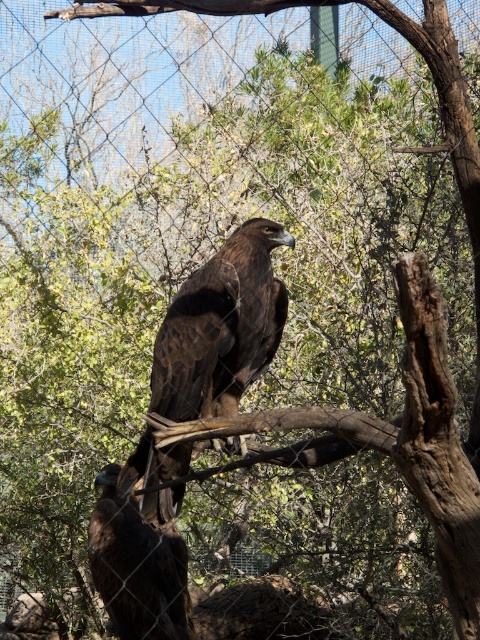
Question: In this image, where is brown feathered eagle at center located relative to dark brown feathers at center?

Choices:
 (A) left
 (B) right

Answer: (B)

Question: Which point is farther to the camera?

Choices:
 (A) dark brown feathers at center
 (B) brown feathered eagle at center

Answer: (A)

Question: Is brown feathered eagle at center above dark brown feathers at center?

Choices:
 (A) no
 (B) yes

Answer: (B)

Question: Can you confirm if brown feathered eagle at center is bigger than dark brown feathers at center?

Choices:
 (A) yes
 (B) no

Answer: (A)

Question: Which of the following is the farthest from the observer?

Choices:
 (A) brown feathered eagle at center
 (B) dark brown feathers at center

Answer: (B)